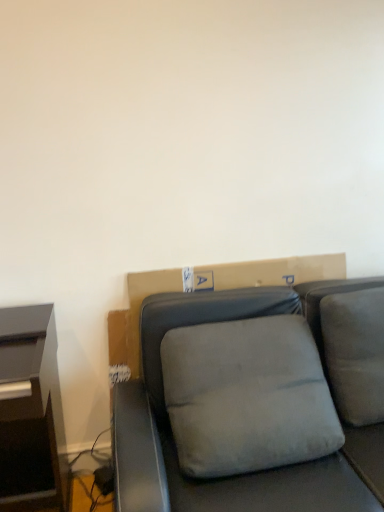
You are a GUI agent. You are given a task and a screenshot of the screen. Output one action in this format:
    pyautogui.click(x=<x>, y=<y>)
    Task: Click on the suede gray pillow at center
    The image size is (384, 512).
    Given the screenshot: What is the action you would take?
    pyautogui.click(x=254, y=404)

What do you see at coordinates (254, 404) in the screenshot? Image resolution: width=384 pixels, height=512 pixels. I see `suede gray pillow at center` at bounding box center [254, 404].

Locate an element on the screen. Image resolution: width=384 pixels, height=512 pixels. suede gray pillow at center is located at coordinates (254, 404).